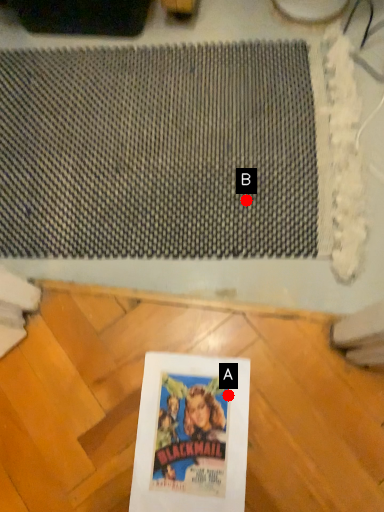
Question: Two points are circled on the image, labeled by A and B beside each circle. Which point is closer to the camera taking this photo?

Choices:
 (A) A is closer
 (B) B is closer

Answer: (A)